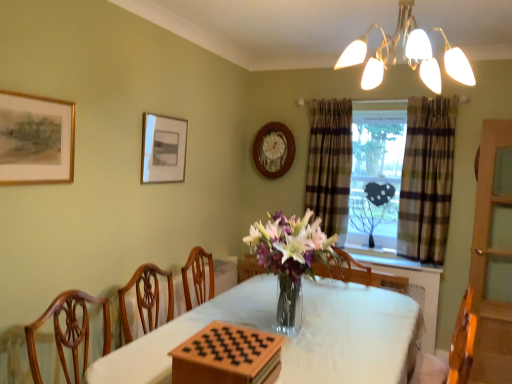
Question: Is white cloth-covered table at center wider or thinner than plaid fabric window at center?

Choices:
 (A) thin
 (B) wide

Answer: (B)

Question: In the image, is white cloth-covered table at center positioned in front of or behind plaid fabric window at center?

Choices:
 (A) front
 (B) behind

Answer: (A)

Question: Which is farther from the matte white picture frame at upper left, which is counted as the second picture frame, starting from the right?

Choices:
 (A) wooden board game at center
 (B) matte gold chandelier at upper center
 (C) wooden clock at upper center, placed as the first picture frame when sorted from back to front
 (D) plaid fabric curtain at center, which ranks as the 1th curtain in left-to-right order
 (E) plaid fabric window at center

Answer: (A)

Question: Which object is the closest to the matte white picture frame at upper left, which is counted as the second picture frame, starting from the right?

Choices:
 (A) plaid fabric curtain at center, which ranks as the 1th curtain in left-to-right order
 (B) wooden clock at upper center, placed as the first picture frame when sorted from right to left
 (C) wooden board game at center
 (D) plaid fabric curtain at window, arranged as the 2th curtain when viewed from the left
 (E) plaid fabric window at center

Answer: (B)